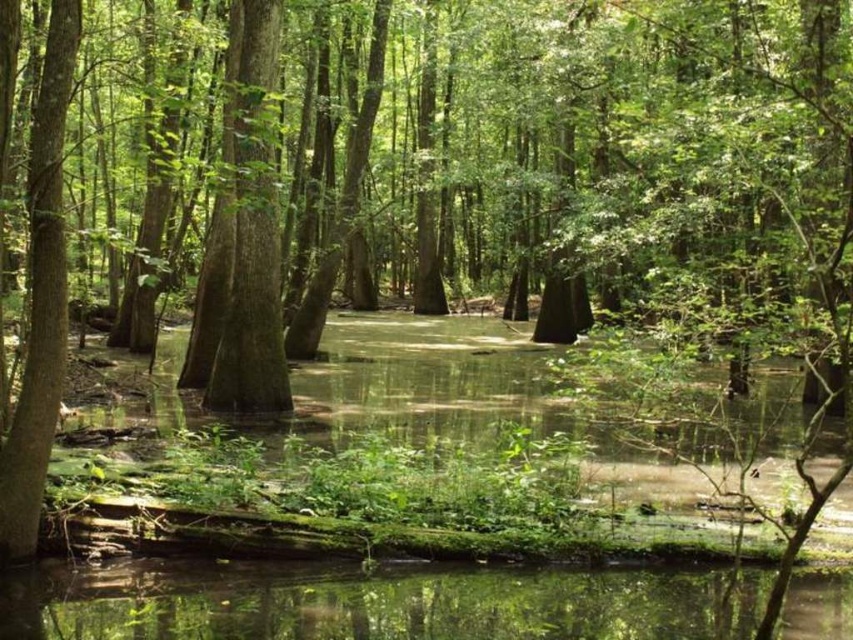
You are a small animal trying to jump from the green rough bark tree at center to the green reflective water at center. Given that your maximum jump distance is 6 meters, can you safely make the leap?

The distance between the green reflective water at center and the green rough bark tree at center is 6.72 meters, which exceeds your maximum jump distance of 6 meters. Therefore, you cannot safely make the leap.

You are standing in the swampy forest and want to cross the water. You see the green reflective water at center and the green rough bark tree at center. Which object is closer to the ground?

The green reflective water at center is located below green rough bark tree at center, so the green reflective water at center is closer to the ground.